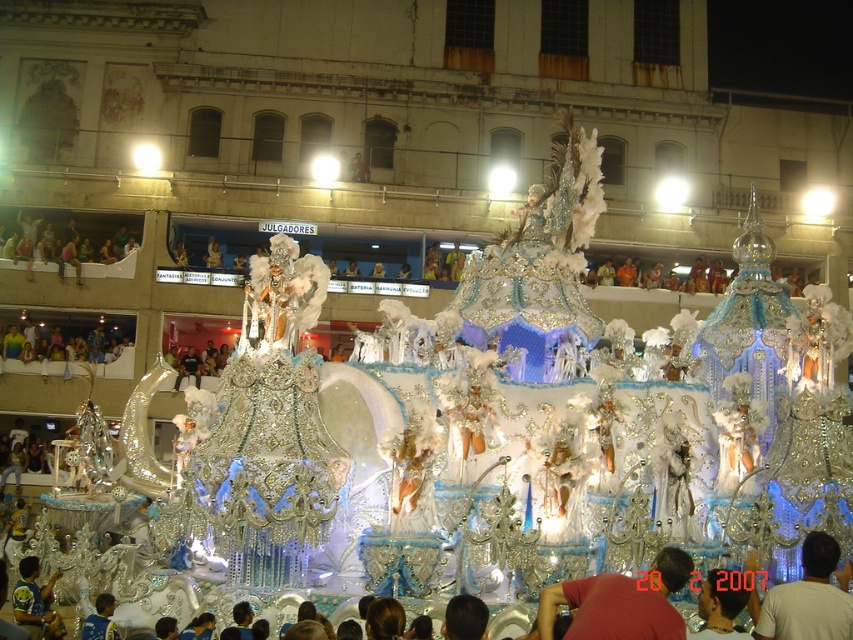
Between red fabric shirt at center and blue jersey at lower left, which one is positioned higher?

red fabric shirt at center is above.

Describe the element at coordinates (619, 602) in the screenshot. I see `red fabric shirt at center` at that location.

At what (x,y) coordinates should I click in order to perform the action: click on red fabric shirt at center. Please return your answer as a coordinate pair (x, y). The height and width of the screenshot is (640, 853). Looking at the image, I should click on (619, 602).

Is silver metallic helmet at center smaller than blue jersey at lower left?

Yes.

Who is more forward, [700,616] or [49,618]?

Point [700,616] is in front.

Image resolution: width=853 pixels, height=640 pixels. Identify the location of silver metallic helmet at center. (720, 604).

Can you confirm if matte white figure at center is bigger than silver metallic helmet at center?

Correct, matte white figure at center is larger in size than silver metallic helmet at center.

Can you confirm if matte white figure at center is positioned below silver metallic helmet at center?

Incorrect, matte white figure at center is not positioned below silver metallic helmet at center.

Who is more distant from viewer, (795, 611) or (724, 573)?

The point (724, 573) is more distant.

Identify the location of matte white figure at center. The width and height of the screenshot is (853, 640). (808, 598).